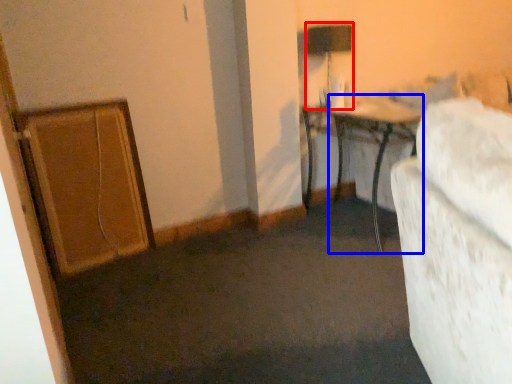
Question: Among these objects, which one is farthest to the camera, table lamp (highlighted by a red box) or table (highlighted by a blue box)?

Choices:
 (A) table lamp
 (B) table

Answer: (A)